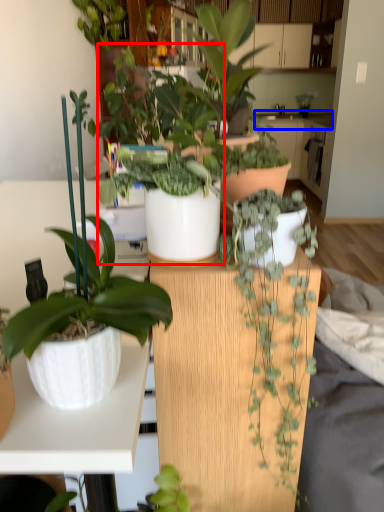
Question: Which object appears farthest to the camera in this image, houseplant (highlighted by a red box) or counter top (highlighted by a blue box)?

Choices:
 (A) houseplant
 (B) counter top

Answer: (B)